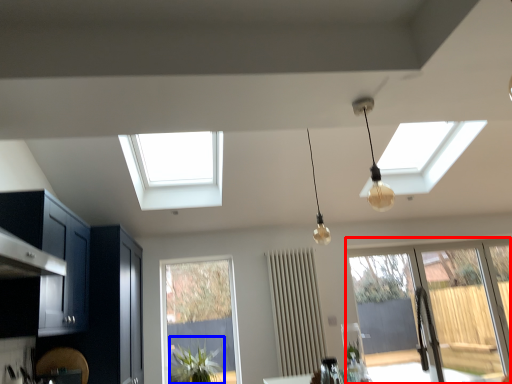
Question: Among these objects, which one is nearest to the camera, window (highlighted by a red box) or plant (highlighted by a blue box)?

Choices:
 (A) window
 (B) plant

Answer: (B)